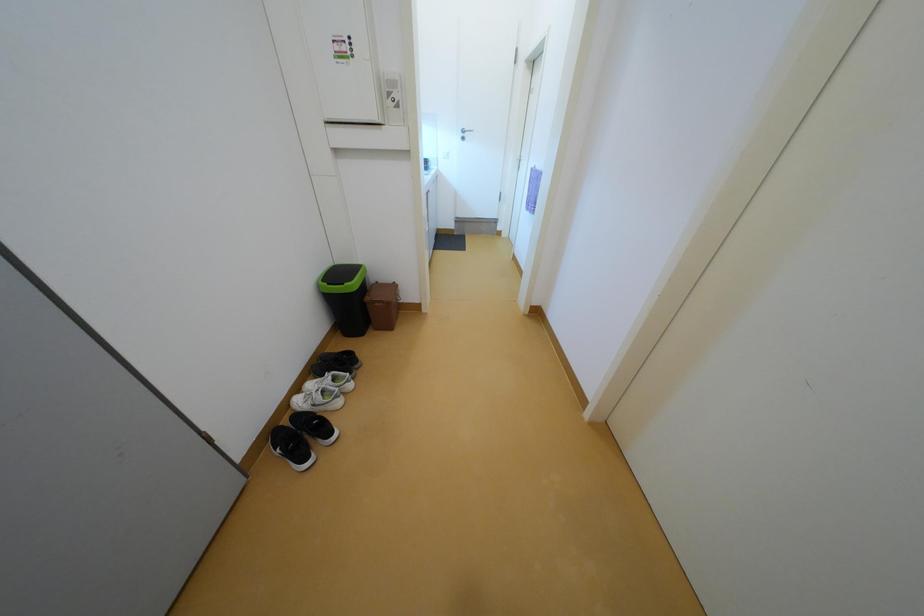
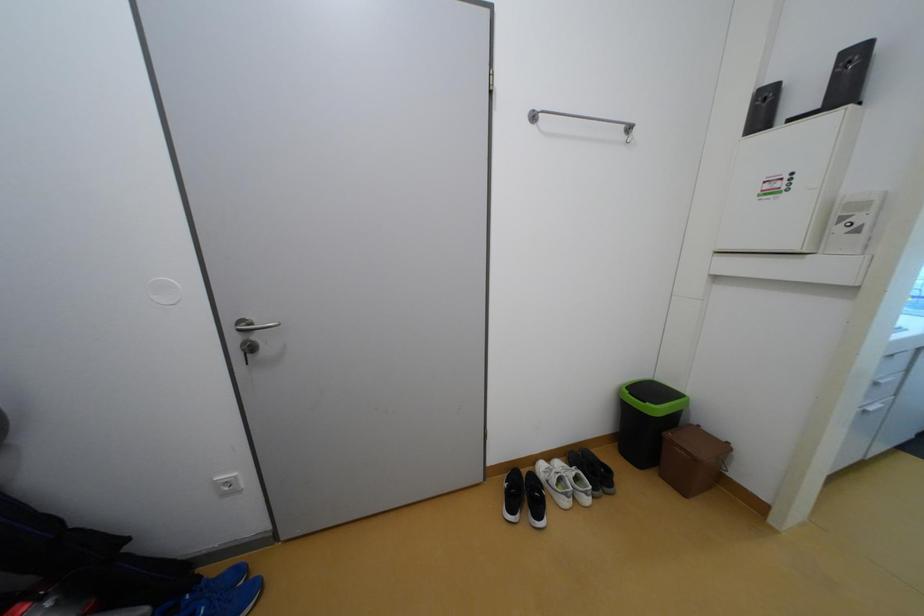
Question: How did the camera likely rotate?

Choices:
 (A) Left
 (B) Right
 (C) Up
 (D) Down

Answer: (A)